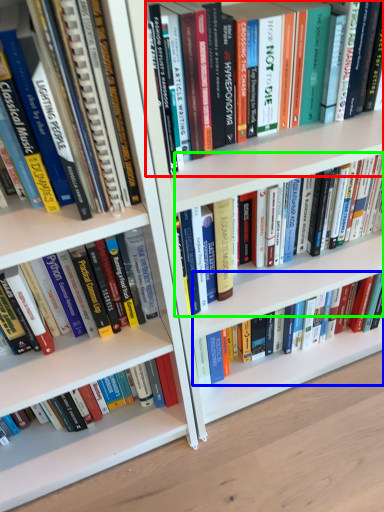
Question: Considering the real-world distances, which object is closest to book (highlighted by a red box)? book (highlighted by a blue box) or book (highlighted by a green box).

Choices:
 (A) book
 (B) book

Answer: (B)